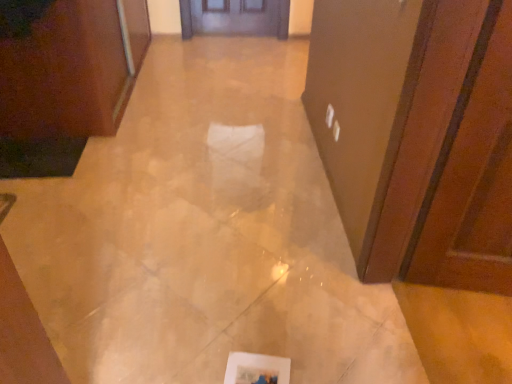
Locate an element on the screen. This screenshot has width=512, height=384. free region under wooden door at right (from a real-world perspective) is located at coordinates (452, 335).